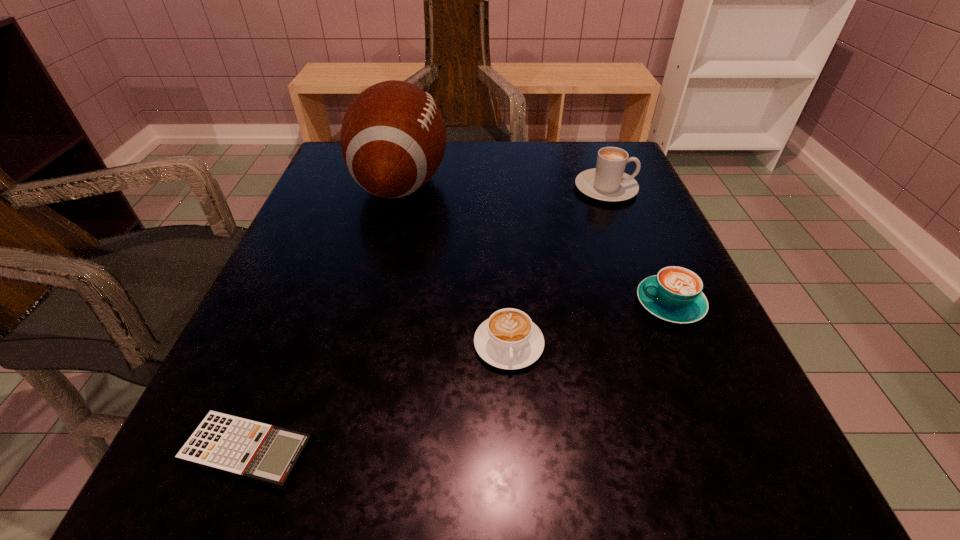
Identify which cappuccino is the closest to the nearest object. Please provide its 2D coordinates. Your answer should be formatted as a tuple, i.e. [(x, y)], where the tuple contains the x and y coordinates of a point satisfying the conditions above.

[(509, 339)]

Identify the location of vacant space that satisfies the following two spatial constraints: 1. to the right of the farthest cappuccino; 2. on the side of the leftmost cappuccino with the handle. (666, 345).